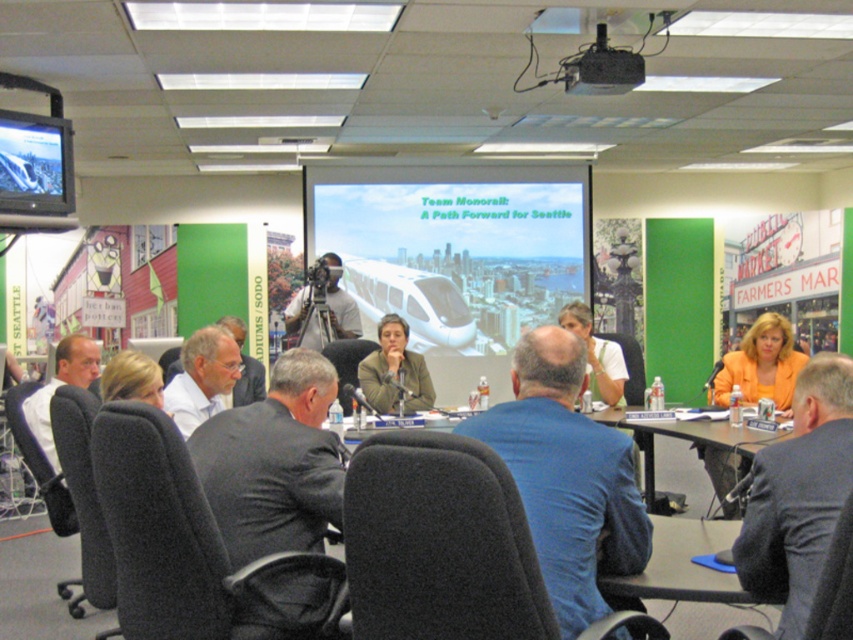
Question: Is gray suit at center smaller than black plastic projector at upper center?

Choices:
 (A) no
 (B) yes

Answer: (B)

Question: Which point is closer to the camera taking this photo?

Choices:
 (A) (199, 422)
 (B) (300, 588)
 (C) (611, 524)
 (D) (730, 374)

Answer: (C)

Question: Can you confirm if black plastic projector at upper center is bigger than matte black camera at center?

Choices:
 (A) no
 (B) yes

Answer: (A)

Question: Which object is farther from the camera taking this photo?

Choices:
 (A) dark gray suit at center
 (B) matte white monorail at center
 (C) matte white shirt at center

Answer: (B)

Question: Which of the following is the closest to the observer?

Choices:
 (A) (601, 378)
 (B) (537, 260)
 (C) (218, 339)
 (D) (624, 77)

Answer: (C)

Question: Is orange blazer at upper right above matte orange blazer at center?

Choices:
 (A) yes
 (B) no

Answer: (B)